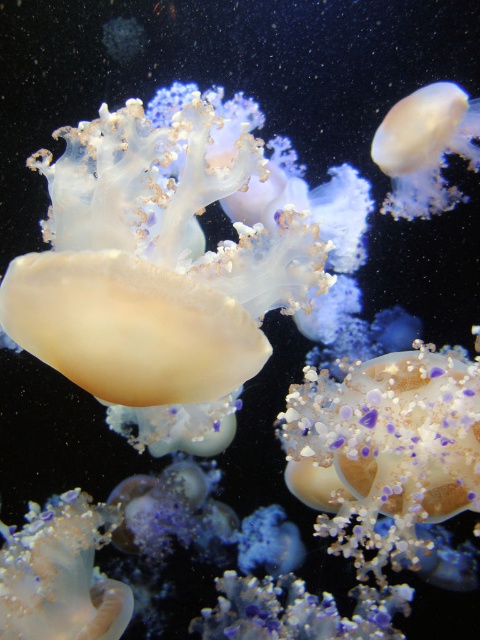
Is point (201, 104) farther from camera compared to point (446, 150)?

No, it is not.

Consider the image. Does translucent gelatinous at center have a smaller size compared to translucent gelatinous at upper right?

Actually, translucent gelatinous at center might be larger than translucent gelatinous at upper right.

Find the location of a particular element. translucent gelatinous at center is located at coordinates (155, 273).

Does translucent gelatinous at lower left come behind translucent gelatinous at upper right?

No, translucent gelatinous at lower left is in front of translucent gelatinous at upper right.

Is point (21, 625) behind point (423, 93)?

No.

Which is in front, point (48, 627) or point (398, 122)?

Point (48, 627) is more forward.

The image size is (480, 640). Find the location of `translucent gelatinous at lower left`. translucent gelatinous at lower left is located at coordinates (59, 576).

Does point (73, 250) come closer to viewer compared to point (55, 628)?

Yes, it is.

Between translucent gelatinous at center and translucent gelatinous at lower left, which one appears on the left side from the viewer's perspective?

From the viewer's perspective, translucent gelatinous at lower left appears more on the left side.

The height and width of the screenshot is (640, 480). Find the location of `translucent gelatinous at center`. translucent gelatinous at center is located at coordinates (155, 273).

Locate an element on the screen. translucent gelatinous at center is located at coordinates (155, 273).